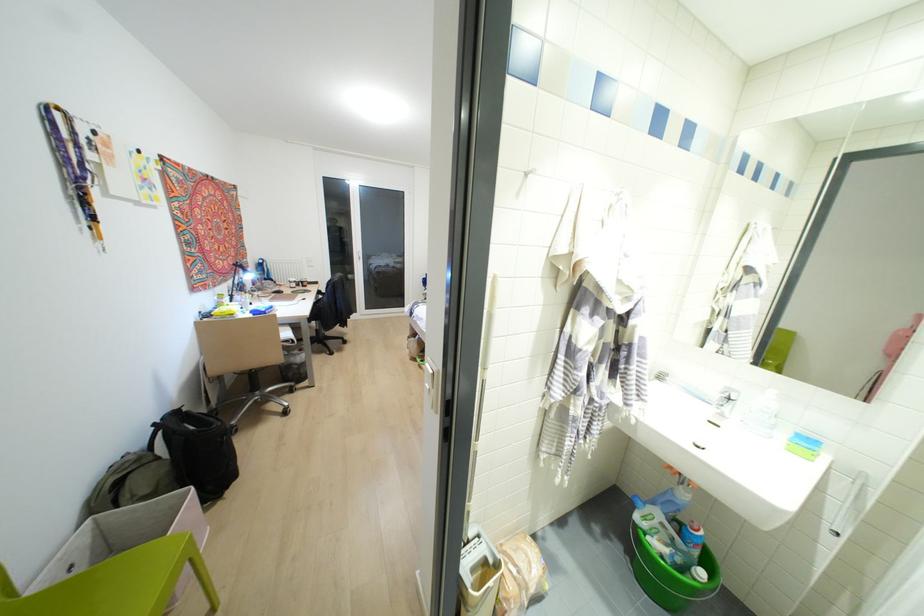
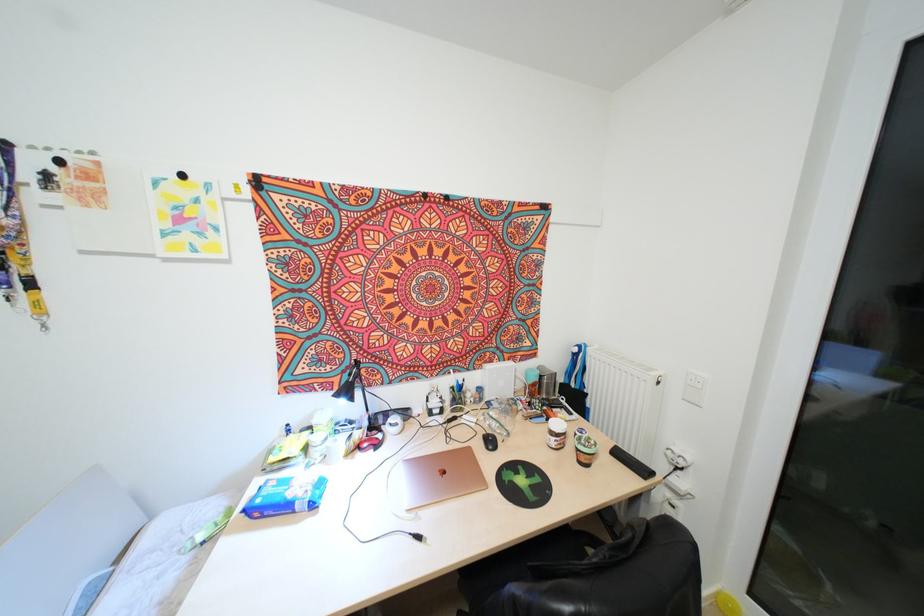
In the second image, find the point that corresponds to point (315, 282) in the first image.

(642, 471)